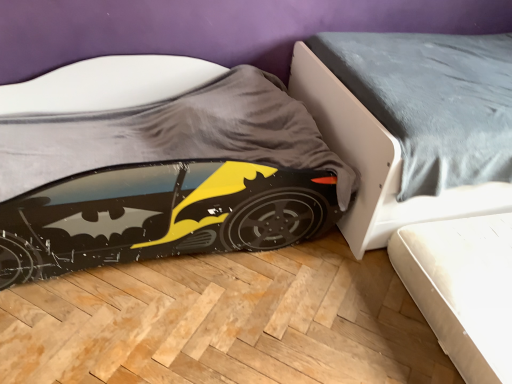
Question: Can you confirm if smooth gray bed at lower right is taller than matt black batmobile at lower left?

Choices:
 (A) yes
 (B) no

Answer: (A)

Question: Is smooth gray bed at lower right at the left side of matt black batmobile at lower left?

Choices:
 (A) yes
 (B) no

Answer: (B)

Question: Is matt black batmobile at lower left completely or partially inside smooth gray bed at lower right?

Choices:
 (A) no
 (B) yes

Answer: (A)

Question: Considering the relative sizes of smooth gray bed at lower right and matt black batmobile at lower left in the image provided, is smooth gray bed at lower right smaller than matt black batmobile at lower left?

Choices:
 (A) no
 (B) yes

Answer: (A)

Question: From the image's perspective, would you say smooth gray bed at lower right is shown under matt black batmobile at lower left?

Choices:
 (A) no
 (B) yes

Answer: (A)

Question: From a real-world perspective, does smooth gray bed at lower right sit lower than matt black batmobile at lower left?

Choices:
 (A) yes
 (B) no

Answer: (B)

Question: Does matt black batmobile at lower left have a greater width compared to smooth gray bed at lower right?

Choices:
 (A) no
 (B) yes

Answer: (A)

Question: Is the depth of matt black batmobile at lower left greater than that of smooth gray bed at lower right?

Choices:
 (A) yes
 (B) no

Answer: (B)

Question: Considering the relative sizes of matt black batmobile at lower left and smooth gray bed at lower right in the image provided, is matt black batmobile at lower left bigger than smooth gray bed at lower right?

Choices:
 (A) no
 (B) yes

Answer: (A)

Question: From the image's perspective, is matt black batmobile at lower left under smooth gray bed at lower right?

Choices:
 (A) no
 (B) yes

Answer: (B)

Question: From the image's perspective, is matt black batmobile at lower left above smooth gray bed at lower right?

Choices:
 (A) no
 (B) yes

Answer: (A)

Question: Can you confirm if matt black batmobile at lower left is smaller than smooth gray bed at lower right?

Choices:
 (A) no
 (B) yes

Answer: (B)

Question: From the image's perspective, is matt black batmobile at lower left located above or below smooth gray bed at lower right?

Choices:
 (A) above
 (B) below

Answer: (B)